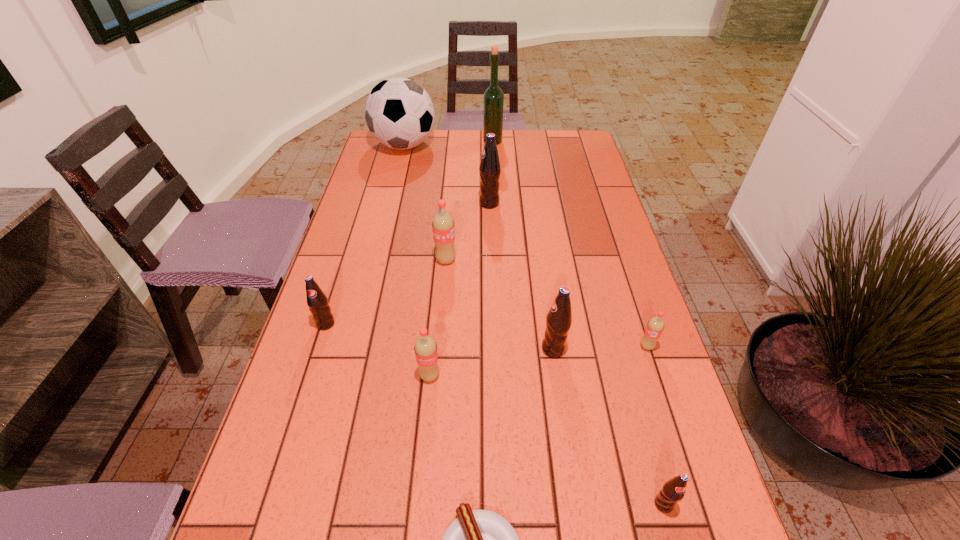
Identify which black pop is the second closest to the eighth object from left to right. Please provide its 2D coordinates. Your answer should be formatted as a tuple, i.e. [(x, y)], where the tuple contains the x and y coordinates of a point satisfying the conditions above.

[(317, 301)]

Locate which black pop ranks second in proximity to the second biggest black pop. Please provide its 2D coordinates. Your answer should be formatted as a tuple, i.e. [(x, y)], where the tuple contains the x and y coordinates of a point satisfying the conditions above.

[(317, 301)]

Locate which red soda ranks third in proximity to the black soccer ball. Please provide its 2D coordinates. Your answer should be formatted as a tuple, i.e. [(x, y)], where the tuple contains the x and y coordinates of a point satisfying the conditions above.

[(655, 326)]

Identify which red soda is the third nearest to the ninth object from left to right. Please provide its 2D coordinates. Your answer should be formatted as a tuple, i.e. [(x, y)], where the tuple contains the x and y coordinates of a point satisfying the conditions above.

[(443, 226)]

Where is `free space that satisfies the following two spatial constraints: 1. on the main logo of the seventh nearest object; 2. on the left side of the soccer ball`? The height and width of the screenshot is (540, 960). free space that satisfies the following two spatial constraints: 1. on the main logo of the seventh nearest object; 2. on the left side of the soccer ball is located at coordinates pyautogui.click(x=376, y=260).

Identify the location of free space that satisfies the following two spatial constraints: 1. on the back side of the rightmost pop; 2. on the left side of the nearest red soda. (432, 346).

Where is `vacant area in the image that satisfies the following two spatial constraints: 1. on the front label of the sixth nearest object; 2. on the right side of the nearest red soda`? This screenshot has width=960, height=540. vacant area in the image that satisfies the following two spatial constraints: 1. on the front label of the sixth nearest object; 2. on the right side of the nearest red soda is located at coordinates (309, 375).

In order to click on free spot that satisfies the following two spatial constraints: 1. on the front label of the tallest pop; 2. on the back side of the second farthest red soda in this screenshot , I will do `click(492, 346)`.